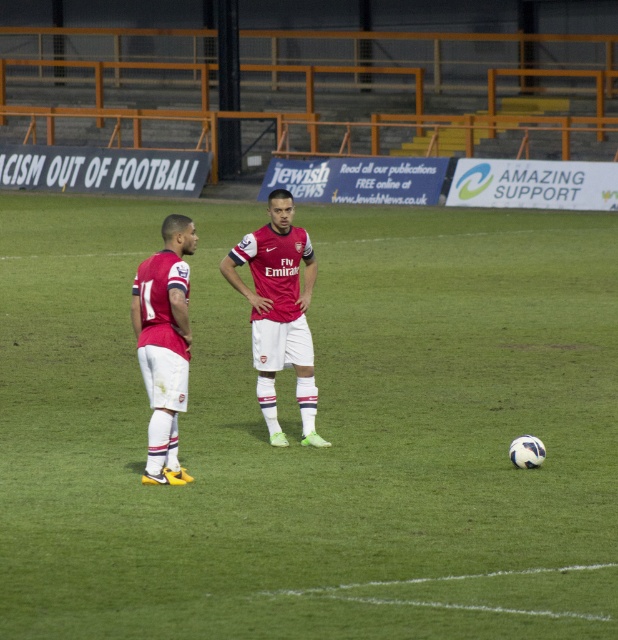
You are a referee standing at the center circle of the football pitch. You need to determine the location of the white smooth soccer ball at center relative to your position. Where is it located?

The white smooth soccer ball at center is located at coordinates point (316, 428), which is to the right and slightly forward from the center circle where you are standing.

You are a photographer standing at the point marked as point [446,586]. You want to take a photo of the football located near the right side of the frame. Considering the distance between you and the football, will you need a telephoto lens to capture the ball clearly?

The distance between you and the football is 9.21 meters. Since telephoto lenses are ideal for capturing distant subjects, you would need a telephoto lens to clearly capture the ball from this distance.